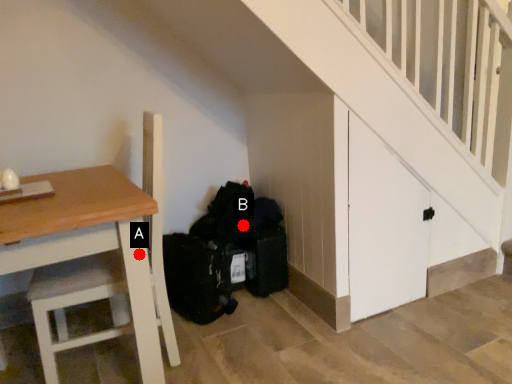
Question: Two points are circled on the image, labeled by A and B beside each circle. Which point is further to the camera?

Choices:
 (A) A is further
 (B) B is further

Answer: (B)